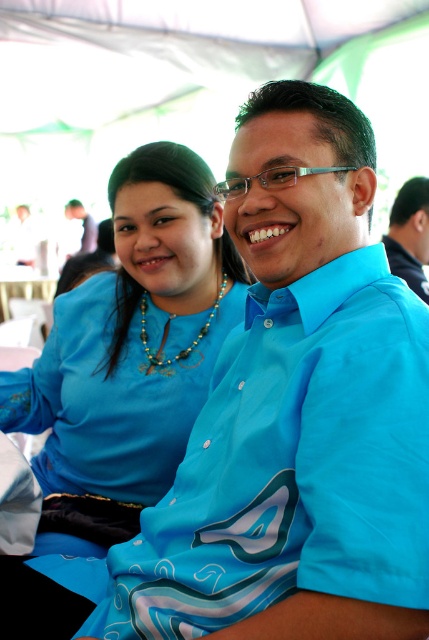
In the scene shown: You are standing in front of the image and want to locate the blue fabric shirt at center. What are its coordinates in the image?

The blue fabric shirt at center is located at coordinates (410, 234) in the image.

You are at an event under a canopy and see two blue items of clothing. The matte blue blouse at left and the blue fabric shirt at center. Which one is positioned more to the right?

The blue fabric shirt at center is positioned more to the right than the matte blue blouse at left.